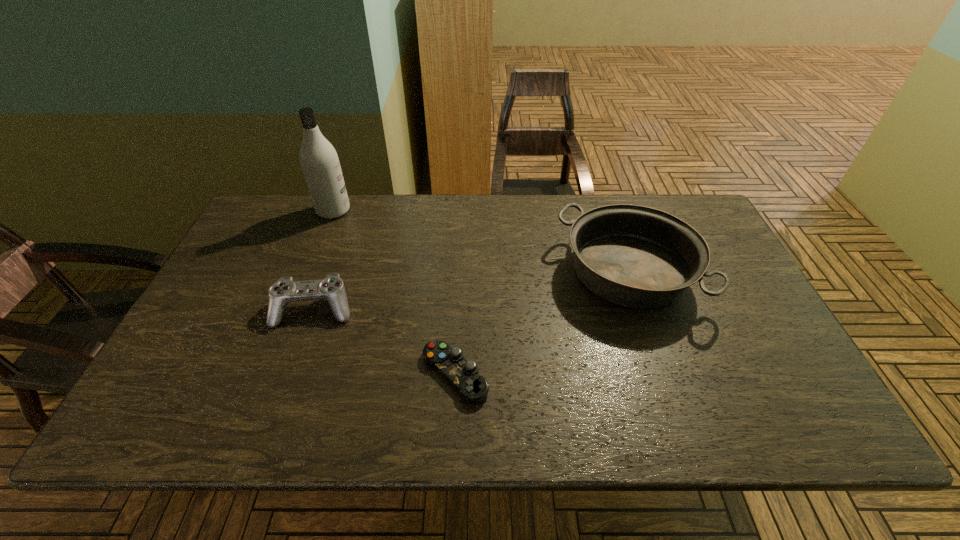
Where is `free spot at the far left corner of the desktop`? This screenshot has width=960, height=540. free spot at the far left corner of the desktop is located at coordinates (246, 239).

You are a GUI agent. You are given a task and a screenshot of the screen. Output one action in this format:
    pyautogui.click(x=<x>, y=<y>)
    Task: Click on the vacant space at the near left corner
    Image resolution: width=960 pixels, height=540 pixels.
    Given the screenshot: What is the action you would take?
    pyautogui.click(x=133, y=427)

The image size is (960, 540). In the image, there is a desktop. Identify the location of vacant space at the far right corner. (690, 217).

Locate an element on the screen. free space between the pan and the shampoo is located at coordinates (481, 241).

The width and height of the screenshot is (960, 540). I want to click on free space between the shorter control and the left control, so click(x=385, y=341).

You are a GUI agent. You are given a task and a screenshot of the screen. Output one action in this format:
    pyautogui.click(x=<x>, y=<y>)
    Task: Click on the free space between the pan and the farthest object
    This screenshot has width=960, height=540.
    Given the screenshot: What is the action you would take?
    pyautogui.click(x=481, y=241)

This screenshot has height=540, width=960. I want to click on empty space that is in between the left control and the farthest object, so click(324, 260).

This screenshot has height=540, width=960. In order to click on vacant space that's between the farther control and the shampoo in this screenshot , I will do `click(324, 260)`.

What are the coordinates of `free space between the left control and the pan` in the screenshot? It's located at tap(471, 291).

The image size is (960, 540). Find the location of `free space between the farthest object and the nearer control`. free space between the farthest object and the nearer control is located at coordinates (395, 292).